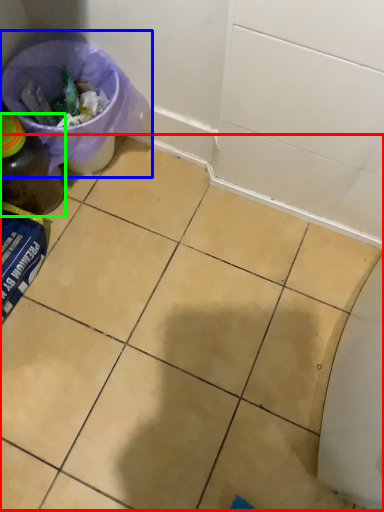
Question: Estimate the real-world distances between objects in this image. Which object is farther from ceramic tile (highlighted by a red box), recycling bin (highlighted by a blue box) or bottle (highlighted by a green box)?

Choices:
 (A) recycling bin
 (B) bottle

Answer: (B)